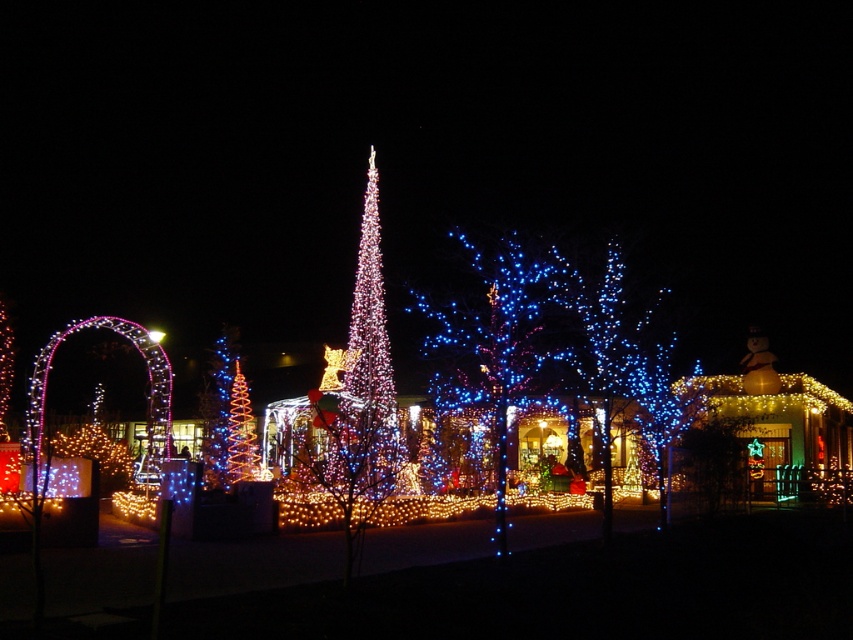
I want to click on blue glossy tree at center, so click(x=498, y=339).

Is blue glossy tree at center taller than spiral-patterned lights at center?

Correct, blue glossy tree at center is much taller as spiral-patterned lights at center.

This screenshot has height=640, width=853. What do you see at coordinates (498, 339) in the screenshot?
I see `blue glossy tree at center` at bounding box center [498, 339].

The height and width of the screenshot is (640, 853). Identify the location of blue glossy tree at center. (498, 339).